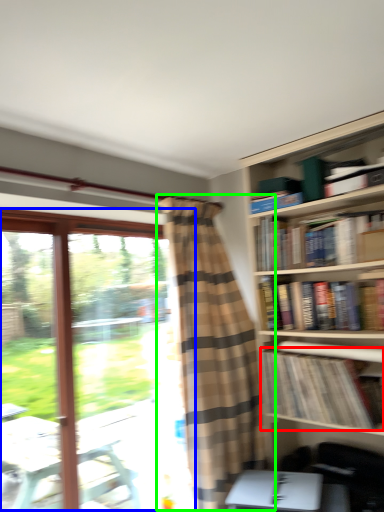
Question: Considering the real-world distances, which object is closest to book (highlighted by a red box)? window (highlighted by a blue box) or curtain (highlighted by a green box).

Choices:
 (A) window
 (B) curtain

Answer: (B)